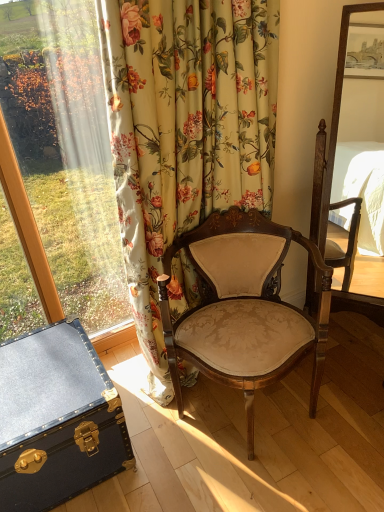
The width and height of the screenshot is (384, 512). What are the coordinates of `free spot to the right of blue leather trunk at lower left` in the screenshot? It's located at (165, 451).